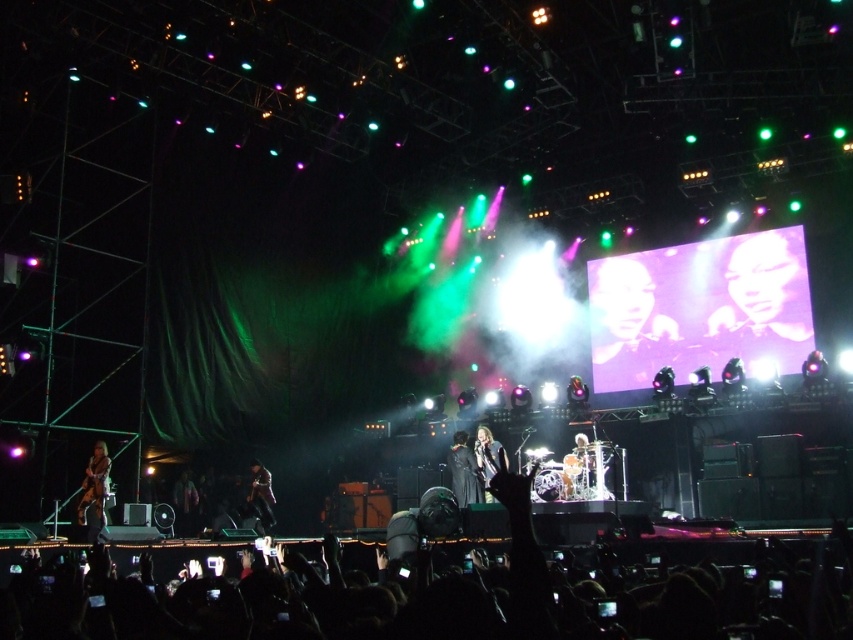
Question: Considering the real-world distances, which object is closest to the dark fabric jacket at lower left?

Choices:
 (A) shiny silver drum set at center
 (B) smooth purple face at upper right
 (C) shiny black jacket at center

Answer: (C)

Question: Considering the relative positions of smooth skin face at upper right and black leather jacket at center in the image provided, where is smooth skin face at upper right located with respect to black leather jacket at center?

Choices:
 (A) left
 (B) right

Answer: (B)

Question: Which object appears closest to the camera in this image?

Choices:
 (A) dark fabric jacket at lower left
 (B) smooth purple face at upper right

Answer: (A)

Question: Is shiny silver drum set at center to the left of black leather jacket at center from the viewer's perspective?

Choices:
 (A) yes
 (B) no

Answer: (B)

Question: In this image, where is shiny black guitar at lower left located relative to dark fabric jacket at lower left?

Choices:
 (A) right
 (B) left

Answer: (B)

Question: Which object is closer to the camera taking this photo?

Choices:
 (A) dark fabric jacket at lower left
 (B) shiny black jacket at center

Answer: (B)